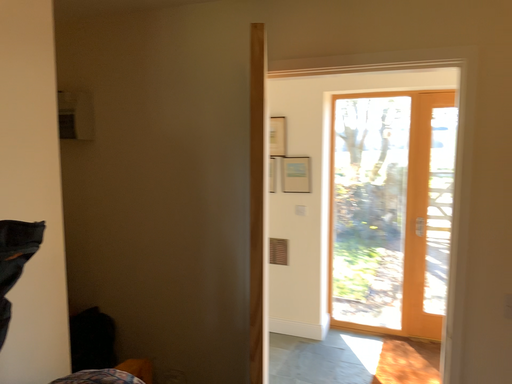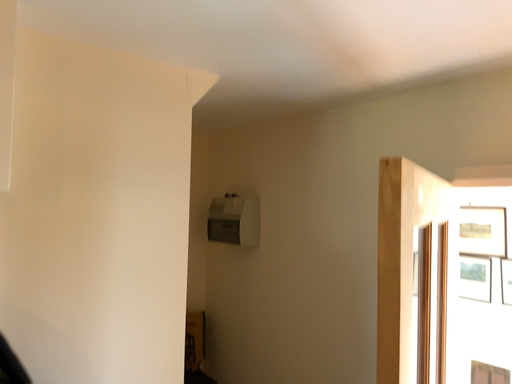
Question: Which way did the camera rotate in the video?

Choices:
 (A) rotated downward
 (B) rotated upward

Answer: (B)